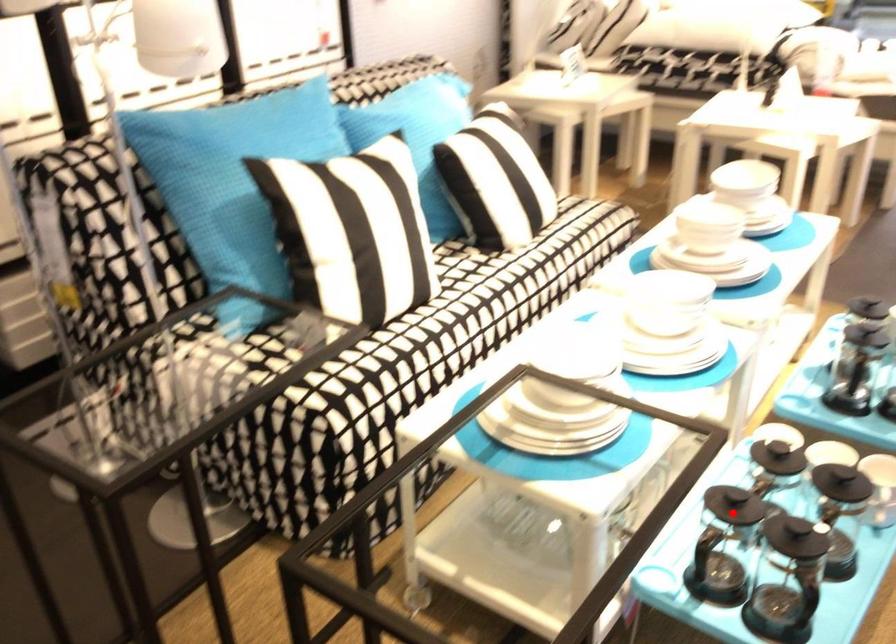
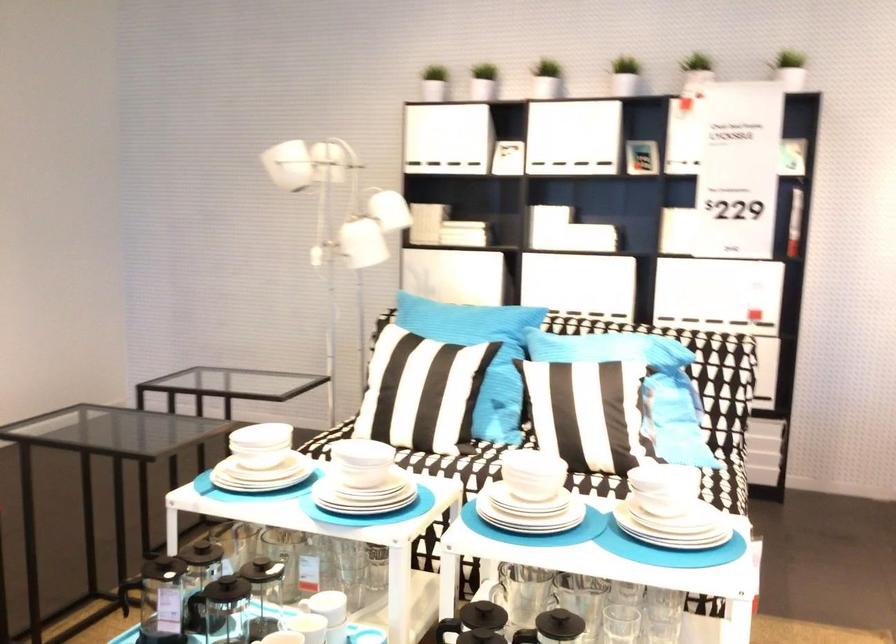
In the second image, find the point that corresponds to the highlighted location in the first image.

(201, 552)